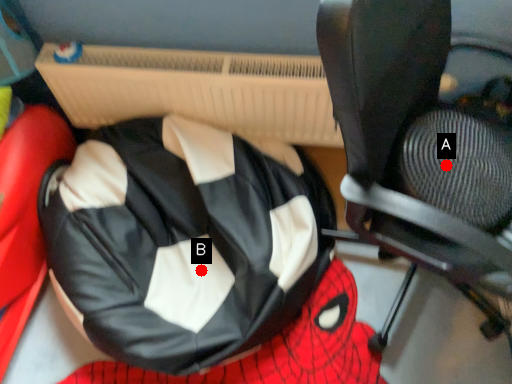
Question: Two points are circled on the image, labeled by A and B beside each circle. Which point is closer to the camera?

Choices:
 (A) A is closer
 (B) B is closer

Answer: (A)